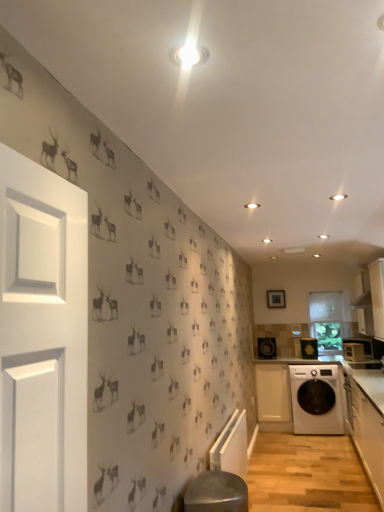
I want to click on white glossy cabinetry at lower right, which appears as the 3th cabinetry when viewed from the back, so click(365, 425).

Measure the distance between point (358, 434) and camera.

A distance of 3.91 meters exists between point (358, 434) and camera.

The height and width of the screenshot is (512, 384). What do you see at coordinates (316, 399) in the screenshot?
I see `white glossy washing machine at lower right` at bounding box center [316, 399].

In order to face white glossy washing machine at lower right, positioned as the 2th appliance in back-to-front order, should I rotate leftwards or rightwards?

A 15.629 degree turn to the right will do.

Locate an element on the screen. Image resolution: width=384 pixels, height=512 pixels. white glossy washing machine at lower right, the second appliance when ordered from left to right is located at coordinates (309, 348).

Find the location of a particular element. This screenshot has width=384, height=512. white matte cabinet at lower right, acting as the first cabinetry starting from the back is located at coordinates (273, 392).

Locate an element on the screen. This screenshot has height=512, width=384. white glossy cabinetry at lower right, placed as the first cabinetry when sorted from front to back is located at coordinates coord(365,425).

The width and height of the screenshot is (384, 512). I want to click on bar stool above the white glossy washing machine at lower right (from the image's perspective), so click(x=216, y=493).

Is white glossy washing machine at lower right surrounding metallic stool at lower center?

No, white glossy washing machine at lower right does not contain metallic stool at lower center.

From the image's perspective, is white glossy washing machine at lower right below metallic stool at lower center?

Yes.

Considering the positions of objects white glossy cabinet at upper right, arranged as the 2th cabinetry when viewed from the back, and white glossy cabinetry at lower right, placed as the first cabinetry when sorted from front to back, in the image provided, who is more to the right, white glossy cabinet at upper right, arranged as the 2th cabinetry when viewed from the back, or white glossy cabinetry at lower right, placed as the first cabinetry when sorted from front to back,?

From the viewer's perspective, white glossy cabinet at upper right, arranged as the 2th cabinetry when viewed from the back, appears more on the right side.

Would you say white glossy cabinet at upper right, which ranks as the 2th cabinetry in front-to-back order, is inside or outside white glossy cabinetry at lower right, which appears as the 3th cabinetry when viewed from the back?

white glossy cabinet at upper right, which ranks as the 2th cabinetry in front-to-back order, cannot be found inside white glossy cabinetry at lower right, which appears as the 3th cabinetry when viewed from the back.

Considering the relative sizes of white glossy cabinet at upper right, which ranks as the 2th cabinetry in front-to-back order, and white glossy cabinetry at lower right, placed as the first cabinetry when sorted from front to back, in the image provided, is white glossy cabinet at upper right, which ranks as the 2th cabinetry in front-to-back order, smaller than white glossy cabinetry at lower right, placed as the first cabinetry when sorted from front to back,?

Yes, white glossy cabinet at upper right, which ranks as the 2th cabinetry in front-to-back order, is smaller than white glossy cabinetry at lower right, placed as the first cabinetry when sorted from front to back.

Does point (380, 283) come closer to viewer compared to point (369, 451)?

That is False.

Is white glossy cabinetry at lower right, which appears as the 3th cabinetry when viewed from the back, facing away from white glossy washing machine at lower right, marked as the 2th appliance in a front-to-back arrangement?

No, white glossy cabinetry at lower right, which appears as the 3th cabinetry when viewed from the back, is not facing the opposite direction of white glossy washing machine at lower right, marked as the 2th appliance in a front-to-back arrangement.

Does point (370, 425) appear closer or farther from the camera than point (309, 343)?

Point (370, 425) is closer to the camera than point (309, 343).

In terms of height, does white glossy cabinetry at lower right, placed as the first cabinetry when sorted from front to back, look taller or shorter compared to white glossy washing machine at lower right, which is the second appliance from right to left?

Considering their sizes, white glossy cabinetry at lower right, placed as the first cabinetry when sorted from front to back, has more height than white glossy washing machine at lower right, which is the second appliance from right to left.

In the scene shown: Is white glossy cabinetry at lower right, which appears as the 3th cabinetry when viewed from the back, positioned far away from white glossy washing machine at lower right, positioned as the 2th appliance in back-to-front order?

Absolutely, white glossy cabinetry at lower right, which appears as the 3th cabinetry when viewed from the back, is distant from white glossy washing machine at lower right, positioned as the 2th appliance in back-to-front order.

Are white glossy cabinet at upper right, which ranks as the 2th cabinetry in front-to-back order, and white glossy washing machine at lower right, marked as the 2th appliance in a front-to-back arrangement, making contact?

No, white glossy cabinet at upper right, which ranks as the 2th cabinetry in front-to-back order, is not with white glossy washing machine at lower right, marked as the 2th appliance in a front-to-back arrangement.

In terms of size, does white glossy cabinet at upper right, which ranks as the 2th cabinetry in front-to-back order, appear bigger or smaller than white glossy washing machine at lower right, which is the second appliance from right to left?

Clearly, white glossy cabinet at upper right, which ranks as the 2th cabinetry in front-to-back order, is larger in size than white glossy washing machine at lower right, which is the second appliance from right to left.

Is white glossy cabinet at upper right, arranged as the 2th cabinetry when viewed from the back, to the right of white glossy washing machine at lower right, the second appliance when ordered from left to right, from the viewer's perspective?

Correct, you'll find white glossy cabinet at upper right, arranged as the 2th cabinetry when viewed from the back, to the right of white glossy washing machine at lower right, the second appliance when ordered from left to right.

From a real-world perspective, who is located lower, white matte cabinet at lower right, acting as the first cabinetry starting from the back, or white glossy cabinet at upper right, which ranks as the 2th cabinetry in front-to-back order?

From a 3D spatial view, white matte cabinet at lower right, acting as the first cabinetry starting from the back, is below.

This screenshot has width=384, height=512. There is a white glossy cabinet at upper right, which ranks as the 2th cabinetry in front-to-back order. In order to click on the 2nd cabinetry below it (from a real-world perspective) in this screenshot , I will do pyautogui.click(x=273, y=392).

Can you confirm if white matte cabinet at lower right, acting as the first cabinetry starting from the back, is bigger than white glossy cabinet at upper right, which ranks as the 2th cabinetry in front-to-back order?

Correct, white matte cabinet at lower right, acting as the first cabinetry starting from the back, is larger in size than white glossy cabinet at upper right, which ranks as the 2th cabinetry in front-to-back order.

Based on their sizes in the image, would you say white glossy washing machine at lower right, the second appliance when ordered from left to right, is bigger or smaller than white glossy cabinetry at lower right, placed as the first cabinetry when sorted from front to back?

In the image, white glossy washing machine at lower right, the second appliance when ordered from left to right, appears to be smaller than white glossy cabinetry at lower right, placed as the first cabinetry when sorted from front to back.

Which object is wider, white glossy washing machine at lower right, which is the second appliance from right to left, or white glossy cabinetry at lower right, placed as the first cabinetry when sorted from front to back?

With larger width is white glossy cabinetry at lower right, placed as the first cabinetry when sorted from front to back.

Considering the points (309, 347) and (358, 377), which point is behind, point (309, 347) or point (358, 377)?

The point (309, 347) is farther.

From a real-world perspective, who is located lower, white glossy washing machine at lower right, the second appliance when ordered from left to right, or white glossy cabinetry at lower right, which appears as the 3th cabinetry when viewed from the back?

white glossy cabinetry at lower right, which appears as the 3th cabinetry when viewed from the back.

Considering the relative sizes of metallic stool at lower center and white glossy cabinet at upper right, which ranks as the 2th cabinetry in front-to-back order, in the image provided, is metallic stool at lower center wider than white glossy cabinet at upper right, which ranks as the 2th cabinetry in front-to-back order,?

Yes, metallic stool at lower center is wider than white glossy cabinet at upper right, which ranks as the 2th cabinetry in front-to-back order.

Is metallic stool at lower center facing towards white glossy cabinet at upper right, which ranks as the 2th cabinetry in front-to-back order?

No, metallic stool at lower center is not turned towards white glossy cabinet at upper right, which ranks as the 2th cabinetry in front-to-back order.

Which is more to the right, metallic stool at lower center or white glossy cabinet at upper right, which ranks as the 2th cabinetry in front-to-back order?

From the viewer's perspective, white glossy cabinet at upper right, which ranks as the 2th cabinetry in front-to-back order, appears more on the right side.

From the image's perspective, would you say metallic stool at lower center is shown under white glossy cabinet at upper right, arranged as the 2th cabinetry when viewed from the back?

Correct, metallic stool at lower center appears lower than white glossy cabinet at upper right, arranged as the 2th cabinetry when viewed from the back, in the image.

The width and height of the screenshot is (384, 512). I want to click on bar stool that is above the white glossy washing machine at lower right (from a real-world perspective), so click(216, 493).

Identify the location of cabinetry that is the 1st one when counting backward from the white glossy cabinetry at lower right, which appears as the 3th cabinetry when viewed from the back. (377, 296).

Estimate the real-world distances between objects in this image. Which object is further from metallic stool at lower center, white glossy washing machine at lower right or white glossy cabinetry at lower right, placed as the first cabinetry when sorted from front to back?

white glossy washing machine at lower right is positioned further to the anchor metallic stool at lower center.

Which object lies nearer to the anchor point black plastic speaker at center, which is counted as the 3th appliance, starting from the front, white glossy cabinetry at lower right, placed as the first cabinetry when sorted from front to back, or white glossy cabinet at upper right, which ranks as the 2th cabinetry in front-to-back order?

Based on the image, white glossy cabinet at upper right, which ranks as the 2th cabinetry in front-to-back order, appears to be nearer to black plastic speaker at center, which is counted as the 3th appliance, starting from the front.

When comparing their distances from white glossy cabinet at upper right, arranged as the 2th cabinetry when viewed from the back, does white glossy washing machine at lower right, which is the second appliance from right to left, or black plastic speaker at center, which is counted as the 3th appliance, starting from the front, seem further?

Among the two, black plastic speaker at center, which is counted as the 3th appliance, starting from the front, is located further to white glossy cabinet at upper right, arranged as the 2th cabinetry when viewed from the back.

Based on their spatial positions, is white glossy cabinetry at lower right, placed as the first cabinetry when sorted from front to back, or black plastic speaker at center, which is counted as the 3th appliance, starting from the front, further from white glossy cabinet at upper right, arranged as the 2th cabinetry when viewed from the back?

The object further to white glossy cabinet at upper right, arranged as the 2th cabinetry when viewed from the back, is black plastic speaker at center, which is counted as the 3th appliance, starting from the front.

From the image, which object appears to be farther from white glossy cabinet at upper right, arranged as the 2th cabinetry when viewed from the back, black plastic speaker at center, the 1th appliance in the left-to-right sequence, or white glossy washing machine at lower right, marked as the 2th appliance in a front-to-back arrangement?

black plastic speaker at center, the 1th appliance in the left-to-right sequence, is positioned further to the anchor white glossy cabinet at upper right, arranged as the 2th cabinetry when viewed from the back.

From the image, which object appears to be farther from white matte cabinet at lower right, the third cabinetry when ordered from front to back, white glossy washing machine at lower right or black plastic speaker at center, which is counted as the 3th appliance, starting from the front?

black plastic speaker at center, which is counted as the 3th appliance, starting from the front, is further to white matte cabinet at lower right, the third cabinetry when ordered from front to back.

Based on their spatial positions, is white glossy cabinet at upper right, which ranks as the 2th cabinetry in front-to-back order, or white matte cabinet at lower right, acting as the first cabinetry starting from the back, closer to white glossy microwave at right, marked as the first appliance in a right-to-left arrangement?

Among the two, white glossy cabinet at upper right, which ranks as the 2th cabinetry in front-to-back order, is located nearer to white glossy microwave at right, marked as the first appliance in a right-to-left arrangement.

Based on their spatial positions, is metallic stool at lower center or white glossy washing machine at lower right further from white glossy cabinet at upper right, arranged as the 2th cabinetry when viewed from the back?

Based on the image, metallic stool at lower center appears to be further to white glossy cabinet at upper right, arranged as the 2th cabinetry when viewed from the back.

What are the coordinates of `appliance positioned between white glossy cabinetry at lower right, placed as the first cabinetry when sorted from front to back, and white matte cabinet at lower right, the third cabinetry when ordered from front to back, from near to far` in the screenshot? It's located at (353, 352).

You are a GUI agent. You are given a task and a screenshot of the screen. Output one action in this format:
    pyautogui.click(x=<x>, y=<y>)
    Task: Click on the washing machine located between white glossy cabinet at upper right, which ranks as the 2th cabinetry in front-to-back order, and black plastic speaker at center, which is counted as the 3th appliance, starting from the front, in the depth direction
    The height and width of the screenshot is (512, 384).
    Given the screenshot: What is the action you would take?
    pyautogui.click(x=316, y=399)

Identify the location of cabinetry between white glossy cabinetry at lower right, which appears as the 3th cabinetry when viewed from the back, and white glossy microwave at right, which is the first appliance in front-to-back order, from front to back. Image resolution: width=384 pixels, height=512 pixels. (377, 296).

The image size is (384, 512). In order to click on appliance between black plastic speaker at center, the 1th appliance in the left-to-right sequence, and white glossy microwave at right, which is the first appliance in front-to-back order, in the horizontal direction in this screenshot , I will do `click(309, 348)`.